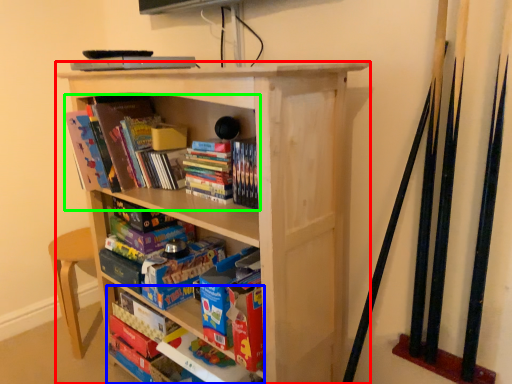
Question: Which object is the farthest from bookcase (highlighted by a red box)? Choose among these: book (highlighted by a blue box) or book (highlighted by a green box).

Choices:
 (A) book
 (B) book

Answer: (A)